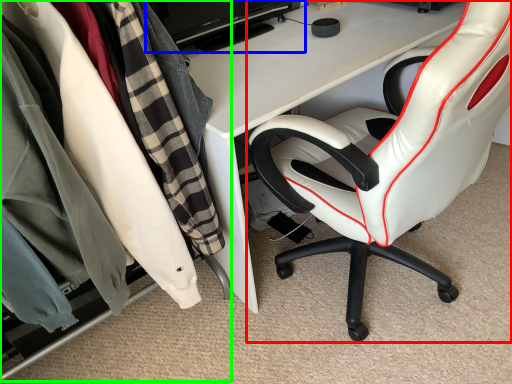
Question: Which is farther away from chair (highlighted by a red box)? computer monitor (highlighted by a blue box) or closet (highlighted by a green box)?

Choices:
 (A) computer monitor
 (B) closet

Answer: (A)